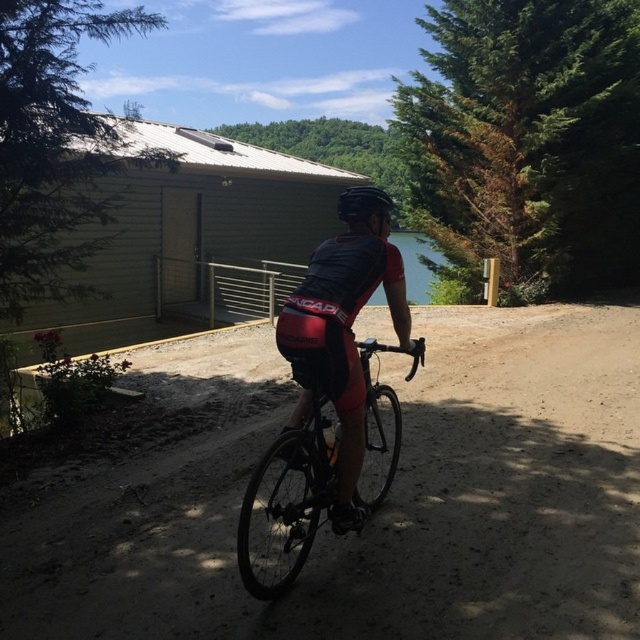
You are a photographer trying to capture the cyclist and the surroundings. Based on the scene, which object, the clear blue water at center or the matte black helmet at center, would appear larger in your photo if you focus on the cyclist?

The clear blue water at center would appear larger in the photo than the matte black helmet at center because it is taller than the matte black helmet at center.

You are standing at the camera position and want to place a 10 feet long banner between yourself and the shiny black bike at center. Is there enough space to place the banner without it overlapping the bike?

The distance between the shiny black bike at center and the camera is 9.65 feet, which is less than the 10 feet length of the banner. Placing the banner would cause it to overlap the bike.